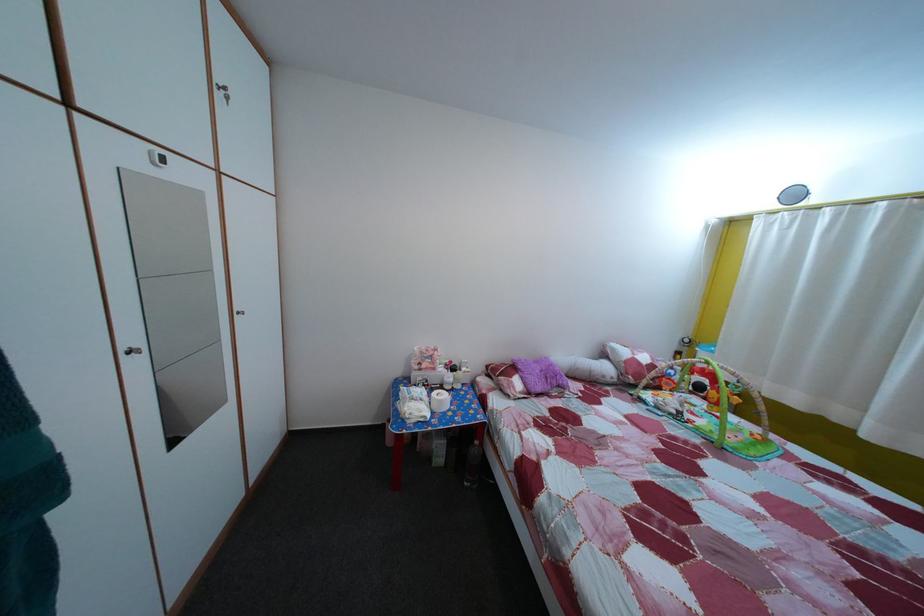
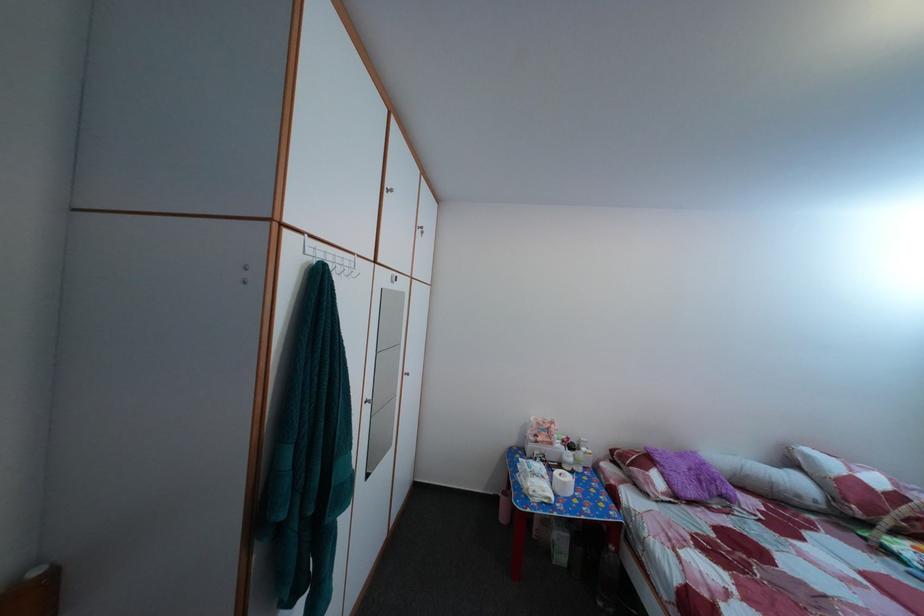
In the second image, find the point that corresponds to pixel 459 370 in the first image.

(578, 447)